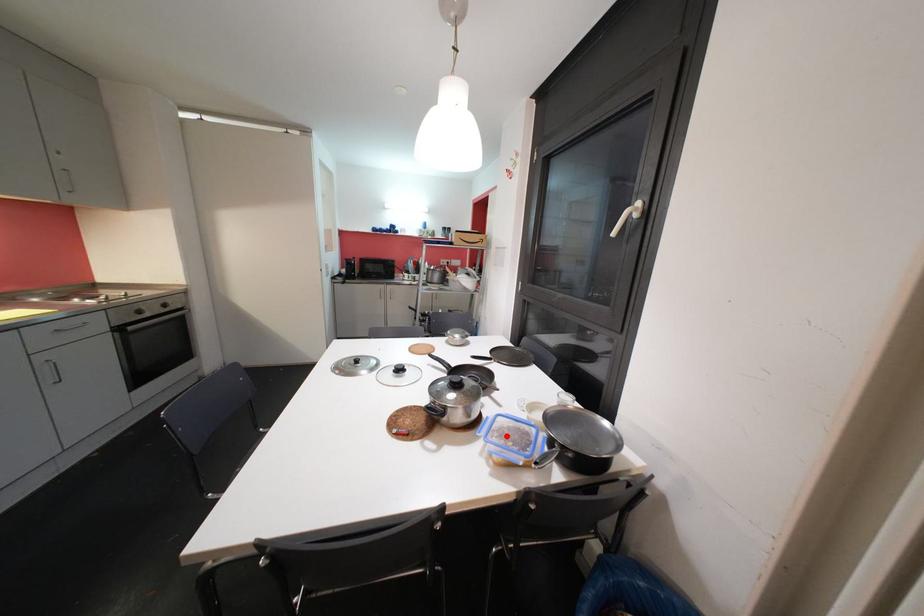
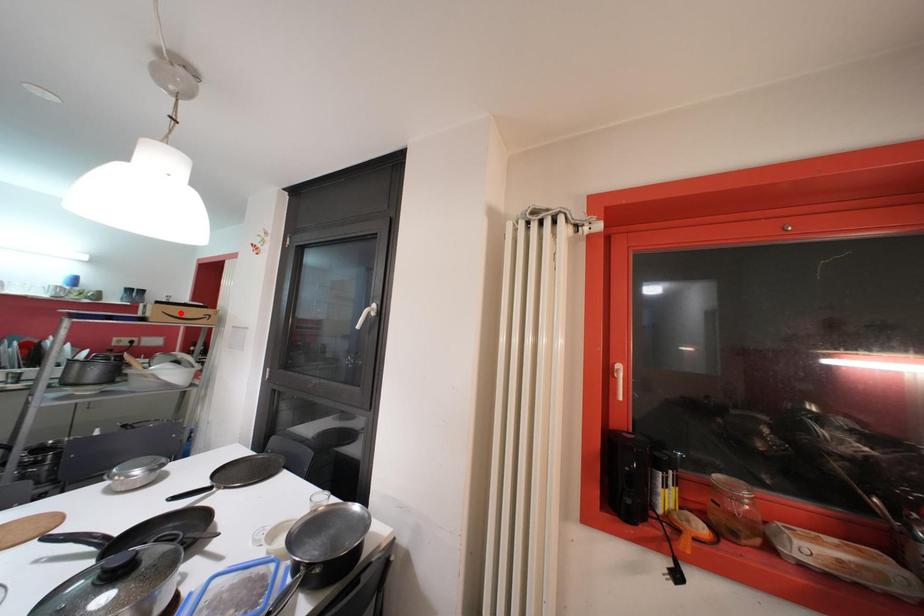
I am providing you with two images of the same scene from different viewpoints. A red point is marked on the first image and another point is marked on the second image. Do the highlighted points in image1 and image2 indicate the same real-world spot?

No